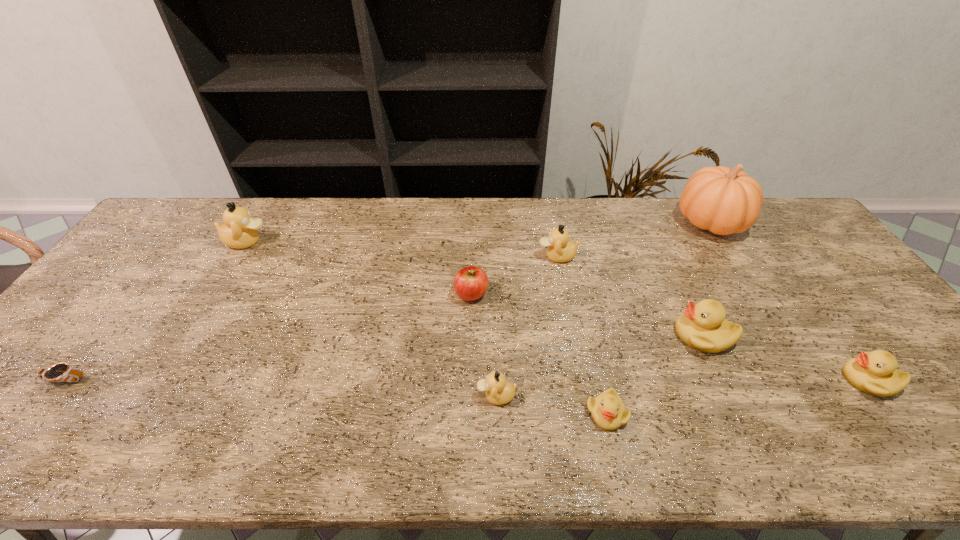
Find the location of a particular element. This screenshot has width=960, height=540. the second closest yellow duckling relative to the second biggest tan duckling is located at coordinates (608, 411).

Locate an element on the screen. This screenshot has width=960, height=540. free location that satisfies the following two spatial constraints: 1. on the face of the leftmost tan duckling; 2. on the back side of the red apple is located at coordinates (215, 294).

Identify the location of free space that satisfies the following two spatial constraints: 1. on the face of the apple; 2. on the right side of the second tallest object. (215, 294).